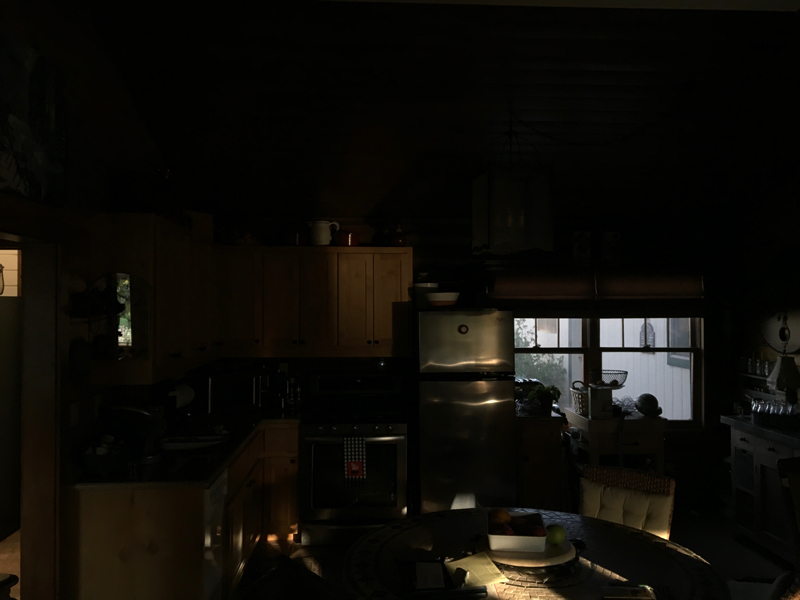
What are the coordinates of `oven` in the screenshot? It's located at (384, 460).